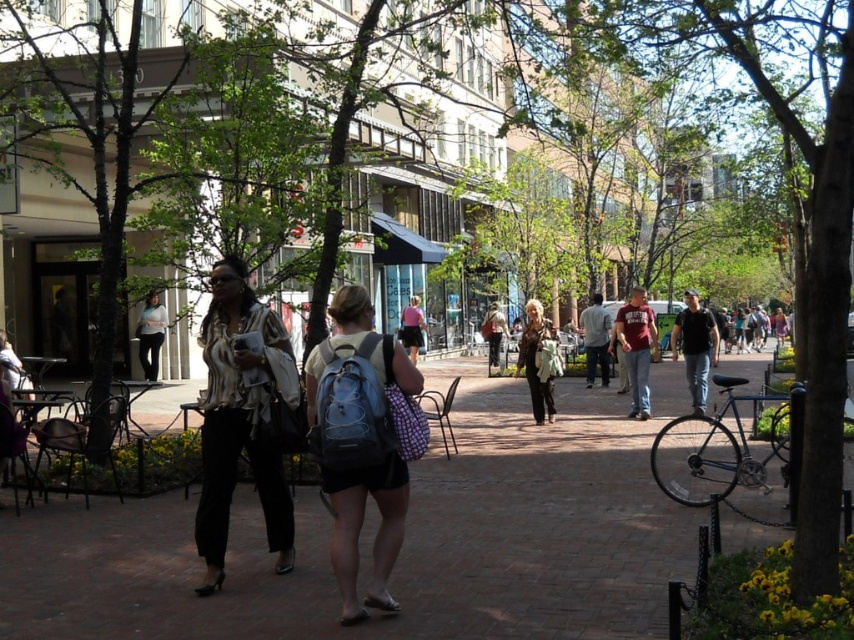
Question: Can you confirm if matte black pants at left is positioned above leather jacket at center?

Choices:
 (A) yes
 (B) no

Answer: (A)

Question: Which of the following is the farthest from the observer?

Choices:
 (A) pink fabric backpack at center
 (B) matte black jacket at center
 (C) maroon fabric shirt at center
 (D) matte black backpack at center

Answer: (D)

Question: Where is maroon fabric shirt at center located in relation to pink fabric backpack at center in the image?

Choices:
 (A) right
 (B) left

Answer: (A)

Question: Observing the image, what is the correct spatial positioning of maroon fabric shirt at center in reference to matte black backpack at center?

Choices:
 (A) left
 (B) right

Answer: (B)

Question: Which of the following is the closest to the observer?

Choices:
 (A) matte black jacket at center
 (B) leather jacket at center

Answer: (B)

Question: Considering the real-world distances, which object is closest to the dark blue jeans at center?

Choices:
 (A) matte black backpack at center
 (B) light blue backpack at center

Answer: (A)